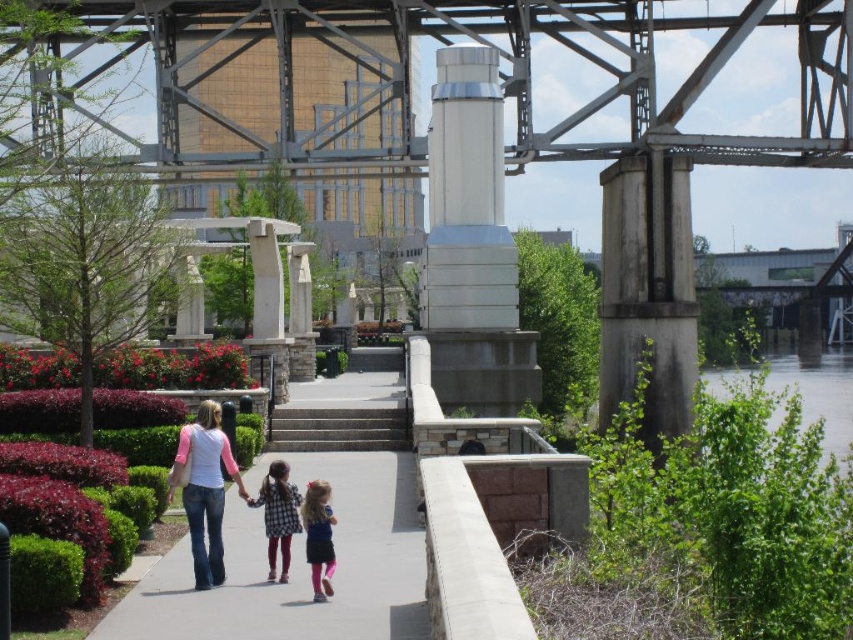
You are a photographer standing on the walkway under the bridge. You see a pink jersey at left and a matte blue dress at center. Which item should you focus on to capture a larger subject in your photo?

The pink jersey at left is larger in size than the matte blue dress at center, so focusing on the pink jersey at left will capture a larger subject in your photo.